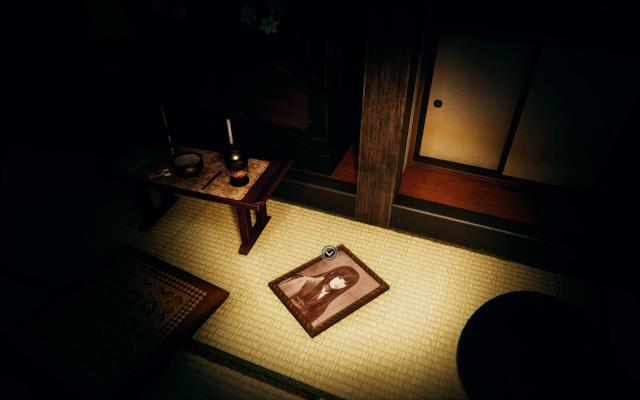
Where is `sliding door`? This screenshot has height=400, width=640. sliding door is located at coordinates (467, 120).